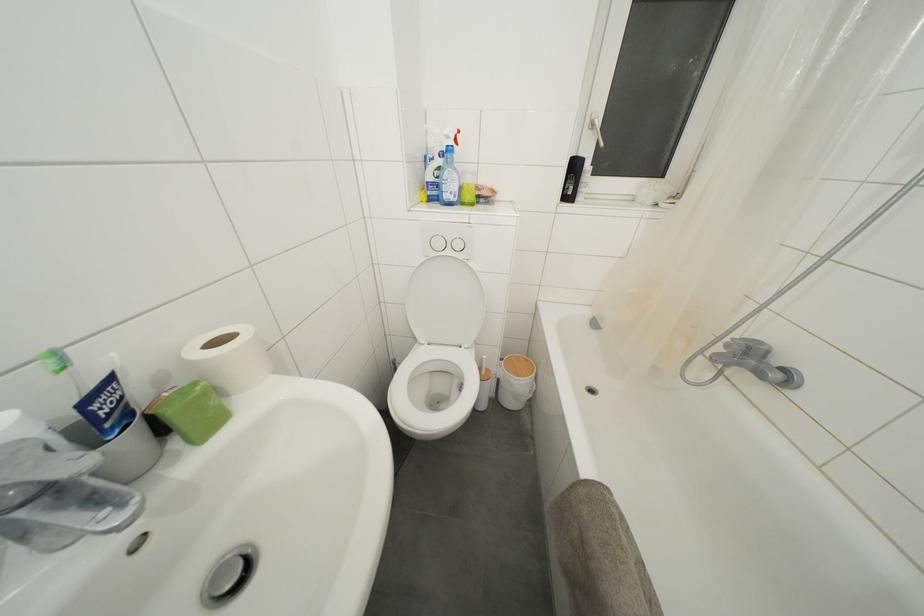
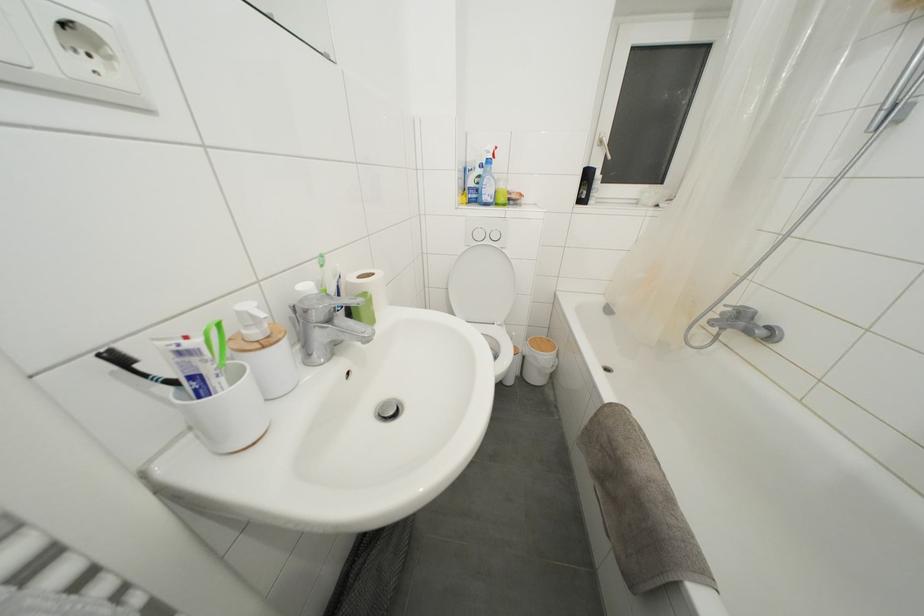
The images are taken continuously from a first-person perspective. In which direction are you moving?

The cameraman walked toward left, backward.